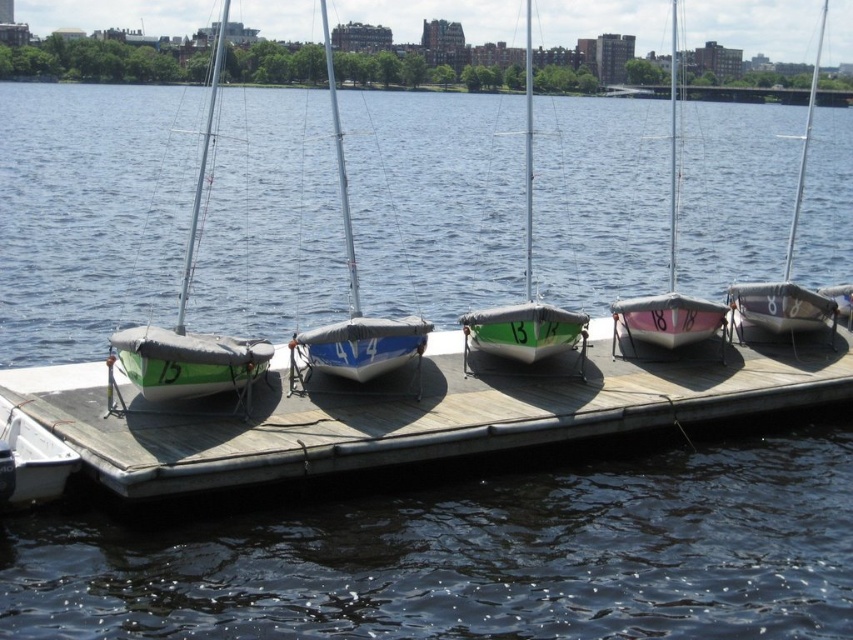
Does point (199, 378) come farther from viewer compared to point (77, 464)?

Yes, it is behind point (77, 464).

Find the location of a particular element. The image size is (853, 640). green matte sailboat at left is located at coordinates (183, 321).

What do you see at coordinates (183, 321) in the screenshot? Image resolution: width=853 pixels, height=640 pixels. I see `green matte sailboat at left` at bounding box center [183, 321].

Find the location of a particular element. Image resolution: width=853 pixels, height=640 pixels. green matte sailboat at left is located at coordinates (183, 321).

This screenshot has height=640, width=853. In order to click on green matte sailboat at left in this screenshot , I will do `click(183, 321)`.

Does white matte sailboat at center have a greater height compared to green matte sailboat at center?

No, white matte sailboat at center is not taller than green matte sailboat at center.

Does white matte sailboat at center appear over green matte sailboat at center?

Yes, white matte sailboat at center is above green matte sailboat at center.

Does point (321, 349) come farther from viewer compared to point (529, 211)?

No, it is not.

Where is `white matte sailboat at center`? This screenshot has width=853, height=640. white matte sailboat at center is located at coordinates (354, 298).